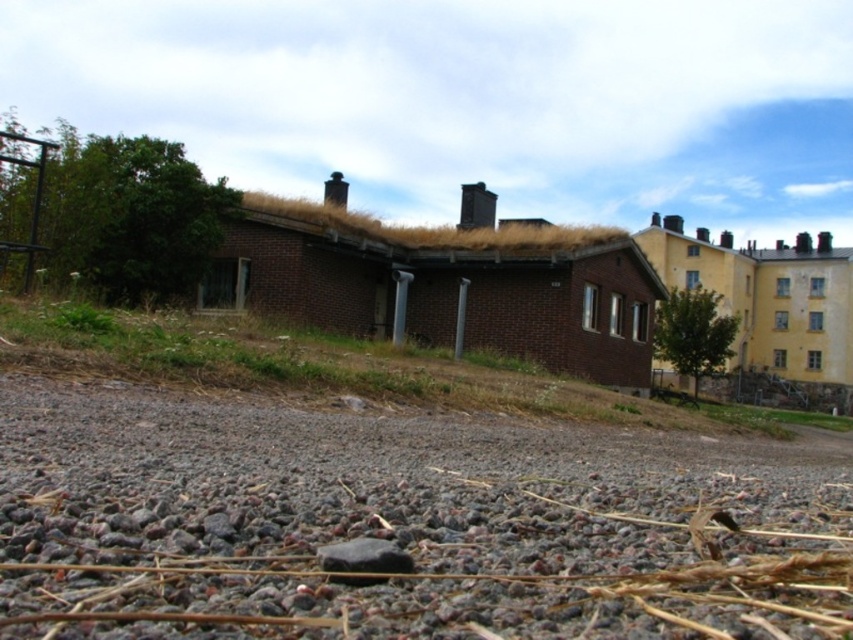
You are standing at the point marked as point (403,525) in the image. Looking around, you notice gray gravel at lower center. What is directly beneath your feet?

The gray gravel at lower center is directly beneath your feet at point (403,525).

You are standing at the gravelly area in the foreground of the scene and want to walk towards the brick building with the green roof. There are two points marked on your path. Which point would you reach first, point [489,518] or point [692,301]?

Point [489,518] is closer to the viewer than point [692,301], so you would reach point [489,518] first.

You are standing on the gravelly area and want to walk to the green leafy tree at right. Is the black smooth rock at lower center blocking your path?

The green leafy tree at right is further to the viewer than the black smooth rock at lower center, so the black smooth rock at lower center is closer to you. Therefore, the black smooth rock at lower center is blocking your path to the green leafy tree at right.